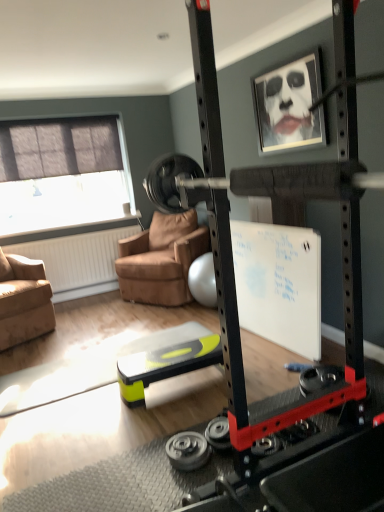
Question: Is suede brown armchair at left, the second chair when ordered from right to left, turned away from brown leather chair at center, the 1th chair viewed from the right?

Choices:
 (A) yes
 (B) no

Answer: (B)

Question: Does suede brown armchair at left, positioned as the 1th chair in left-to-right order, turn towards brown leather chair at center, the 1th chair viewed from the right?

Choices:
 (A) yes
 (B) no

Answer: (B)

Question: From the image's perspective, would you say suede brown armchair at left, the second chair when ordered from right to left, is positioned over brown leather chair at center, marked as the second chair in a left-to-right arrangement?

Choices:
 (A) yes
 (B) no

Answer: (B)

Question: From the image's perspective, is suede brown armchair at left, positioned as the 1th chair in left-to-right order, below brown leather chair at center, marked as the second chair in a left-to-right arrangement?

Choices:
 (A) yes
 (B) no

Answer: (A)

Question: Is suede brown armchair at left, positioned as the 1th chair in left-to-right order, further to the viewer compared to brown leather chair at center, the 1th chair viewed from the right?

Choices:
 (A) yes
 (B) no

Answer: (B)

Question: Is the position of suede brown armchair at left, the second chair when ordered from right to left, less distant than that of brown leather chair at center, the 1th chair viewed from the right?

Choices:
 (A) no
 (B) yes

Answer: (B)

Question: Is matte gray window at upper left facing towards black rubber weight at lower center, the 2th wheel from the top?

Choices:
 (A) yes
 (B) no

Answer: (A)

Question: Is matte gray window at upper left wider than black rubber weight at lower center, which is the 1th wheel in bottom-to-top order?

Choices:
 (A) yes
 (B) no

Answer: (B)

Question: From the image's perspective, is matte gray window at upper left located beneath black rubber weight at lower center, the 2th wheel from the top?

Choices:
 (A) no
 (B) yes

Answer: (A)

Question: Is matte gray window at upper left touching black rubber weight at lower center, the 2th wheel from the top?

Choices:
 (A) yes
 (B) no

Answer: (B)

Question: Is the depth of matte gray window at upper left greater than that of black rubber weight at lower center, which is the 1th wheel in bottom-to-top order?

Choices:
 (A) no
 (B) yes

Answer: (B)

Question: From the image's perspective, is matte gray window at upper left over black rubber weight at lower center, the 2th wheel from the top?

Choices:
 (A) no
 (B) yes

Answer: (B)

Question: From the image's perspective, would you say black rubber weight at lower center, which is the 1th wheel in bottom-to-top order, is shown under matte gray window at upper left?

Choices:
 (A) no
 (B) yes

Answer: (B)